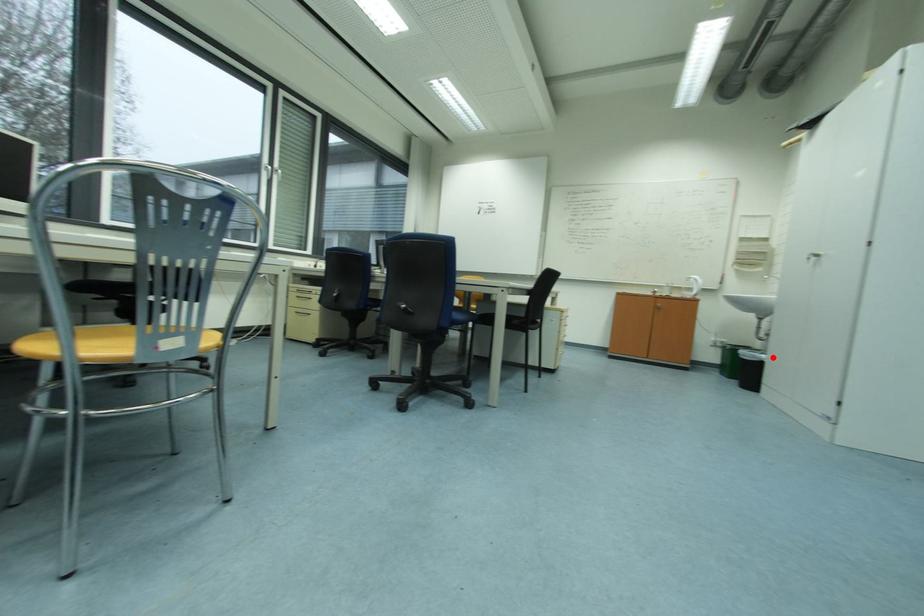
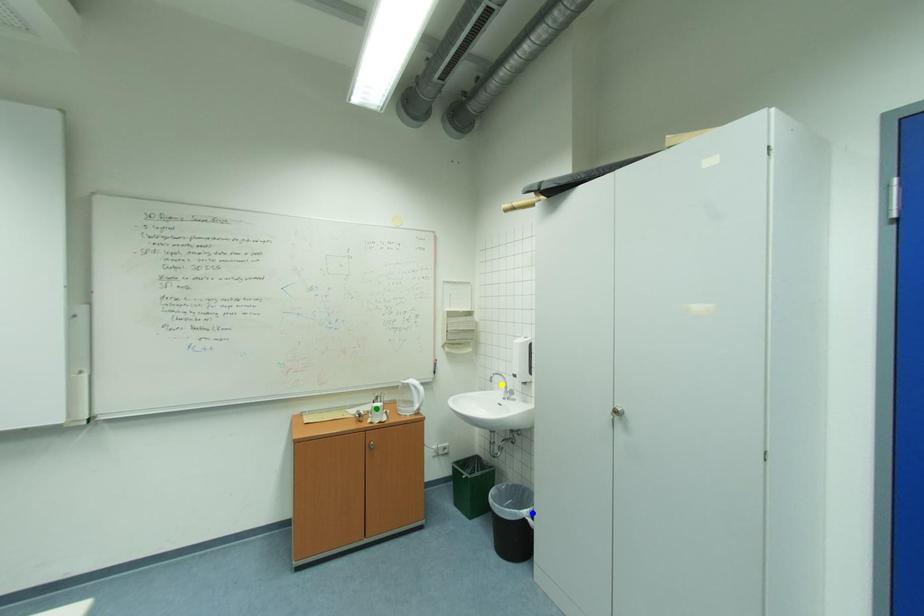
Question: I am providing you with two images of the same scene from different viewpoints. A red point is marked on the first image. You are given multiple points on the second image. Which point in image 2 represents the same 3d spot as the red point in image 1?

Choices:
 (A) green point
 (B) yellow point
 (C) blue point

Answer: (C)